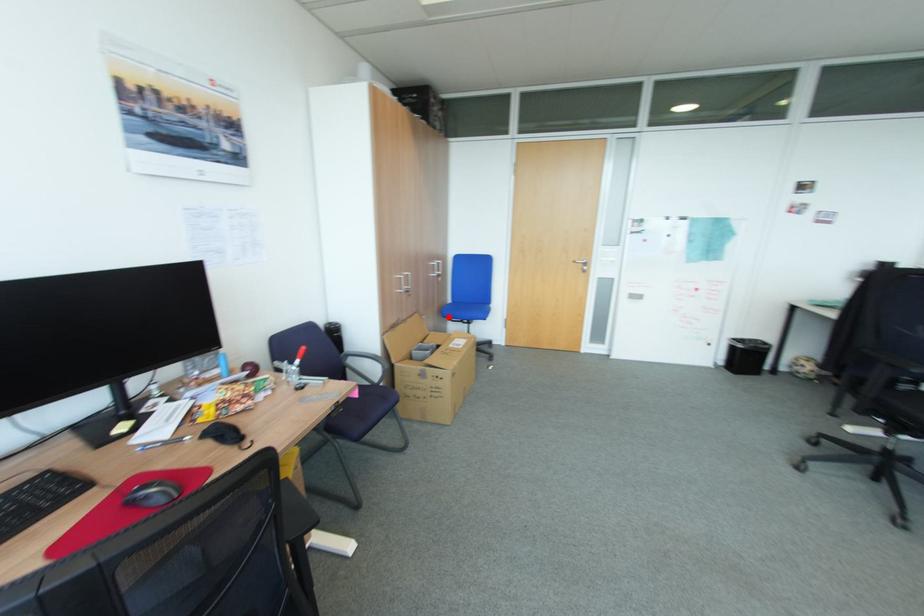
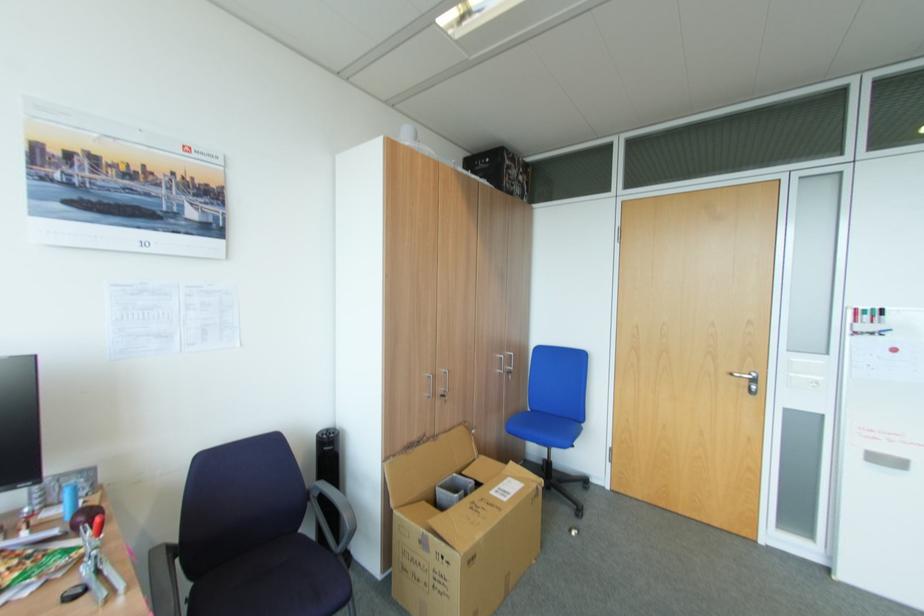
Question: I am providing you with two images of the same scene from different viewpoints. A red point is marked on the first image. Can you still see the location of the red point in image 2?

Choices:
 (A) Yes
 (B) No

Answer: (A)